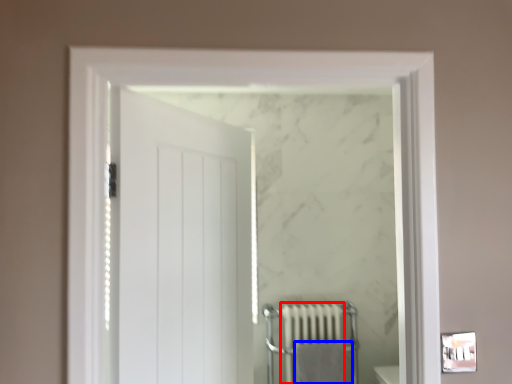
Question: Which object is further to the camera taking this photo, radiator (highlighted by a red box) or bath towel (highlighted by a blue box)?

Choices:
 (A) radiator
 (B) bath towel

Answer: (A)